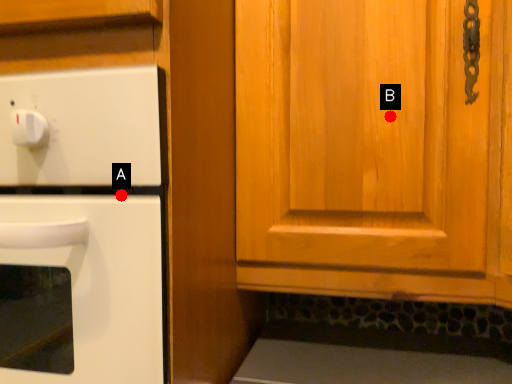
Question: Two points are circled on the image, labeled by A and B beside each circle. Among these points, which one is nearest to the camera?

Choices:
 (A) A is closer
 (B) B is closer

Answer: (A)